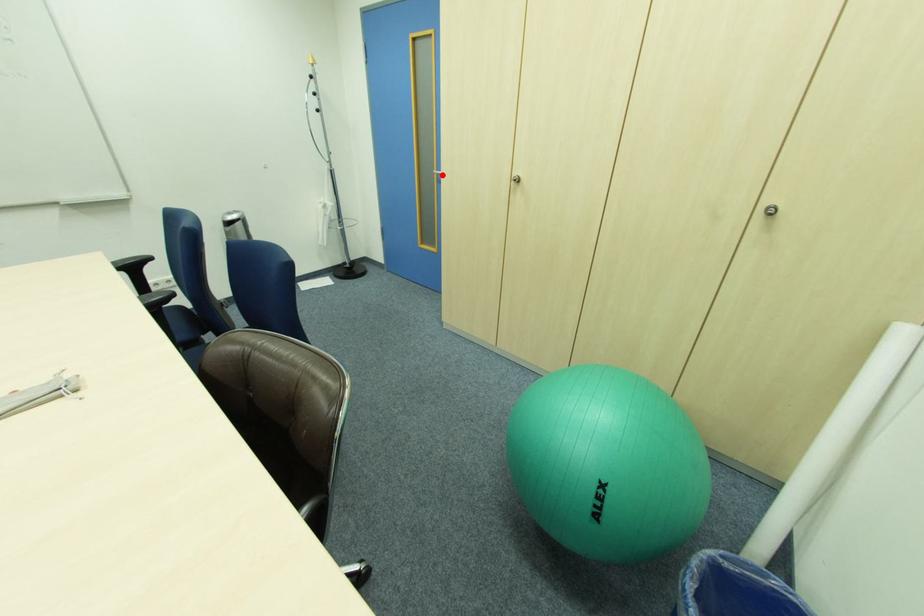
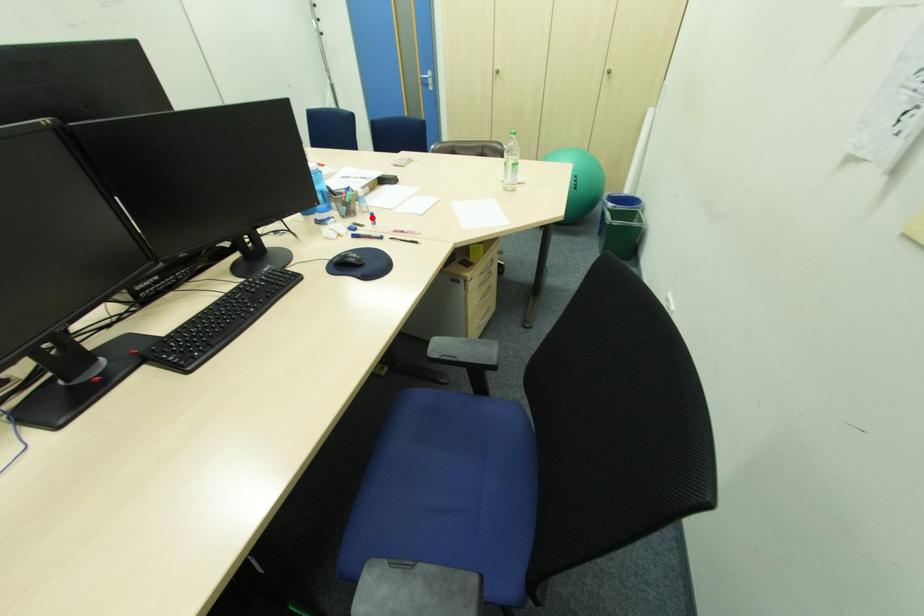
I am providing you with two images of the same scene from different viewpoints. A red point is marked on the first image and another point is marked on the second image. Are the points marked in image1 and image2 representing the same 3D position?

A: No